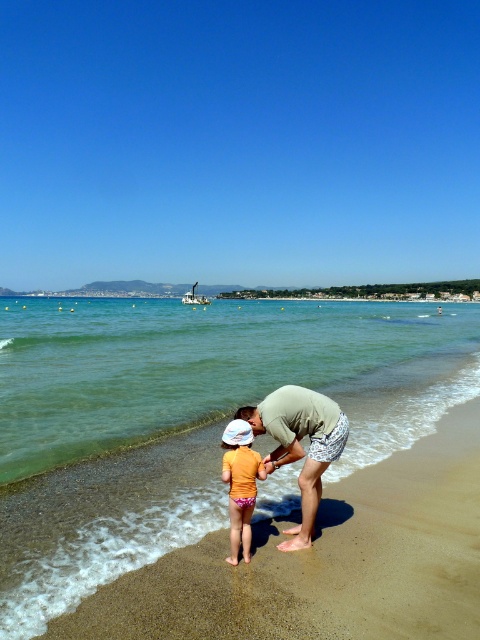
Does clear blue water at lower center have a lesser width compared to light green fabric at center?

No, clear blue water at lower center is not thinner than light green fabric at center.

Does point (409, 348) come in front of point (315, 404)?

That is False.

What are the coordinates of `clear blue water at lower center` in the screenshot? It's located at point(216,369).

Between sandy beach at lower center and orange fabric toddler at center, which one is positioned lower?

sandy beach at lower center is lower down.

The height and width of the screenshot is (640, 480). Describe the element at coordinates (324, 563) in the screenshot. I see `sandy beach at lower center` at that location.

Find the location of a particular element. The width and height of the screenshot is (480, 640). sandy beach at lower center is located at coordinates pyautogui.click(x=324, y=563).

Does light green fabric at center appear over orange fabric toddler at center?

Yes.

Who is more distant from viewer, (295,438) or (231,481)?

The point (295,438) is more distant.

Find the location of `light green fabric at center`. light green fabric at center is located at coordinates (300, 444).

Identify the location of light green fabric at center. (300, 444).